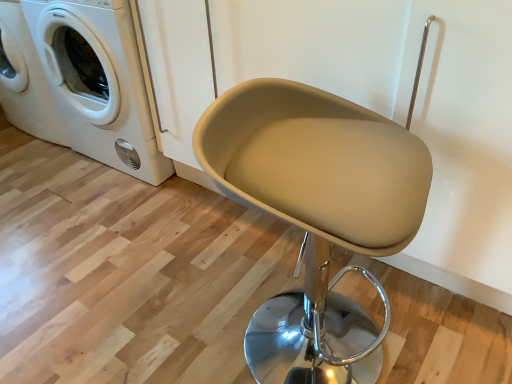
Identify the location of vacant area that lies to the right of beige fabric swivel chair at center. The image size is (512, 384). (430, 327).